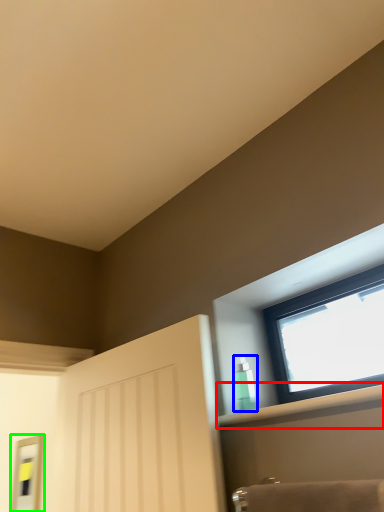
Question: Which is nearer to the shelf (highlighted by a red box)? toiletry (highlighted by a blue box) or mirror (highlighted by a green box).

Choices:
 (A) toiletry
 (B) mirror

Answer: (A)